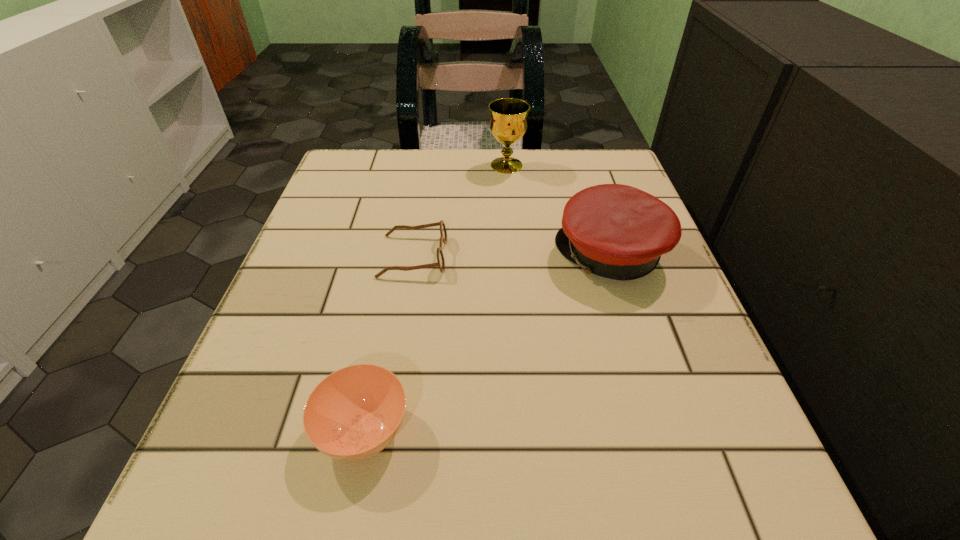
Identify the location of free space at the near edge. coord(588,509).

In the image, there is a desktop. Identify the location of vacant space at the left edge. The height and width of the screenshot is (540, 960). (354, 213).

I want to click on free space at the right edge, so click(660, 405).

In the image, there is a desktop. What are the coordinates of `vacant space at the far left corner` in the screenshot? It's located at (361, 152).

Locate an element on the screen. Image resolution: width=960 pixels, height=540 pixels. vacant space at the far right corner of the desktop is located at coordinates (589, 160).

Where is `free spot between the shortest object and the rightmost object`? This screenshot has height=540, width=960. free spot between the shortest object and the rightmost object is located at coordinates (512, 255).

This screenshot has width=960, height=540. What are the coordinates of `free spot between the rightmost object and the farthest object` in the screenshot? It's located at (559, 210).

What are the coordinates of `vacant point located between the spectacles and the second shortest object` in the screenshot? It's located at coord(389,343).

Where is `unoccupied area between the shortest object and the rightmost object`? This screenshot has height=540, width=960. unoccupied area between the shortest object and the rightmost object is located at coordinates (512, 255).

Where is `unoccupied area between the cap and the chalice`? The image size is (960, 540). unoccupied area between the cap and the chalice is located at coordinates (559, 210).